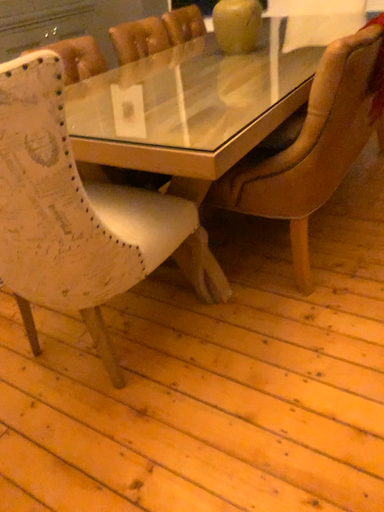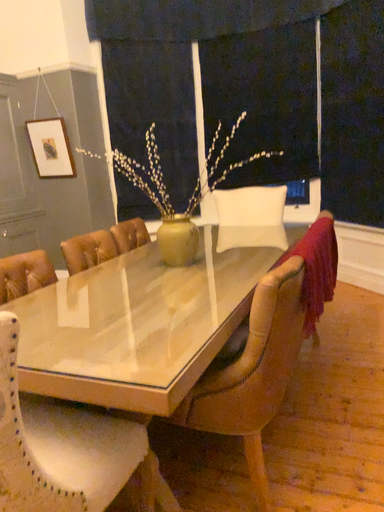
Question: How did the camera likely rotate when shooting the video?

Choices:
 (A) rotated left
 (B) rotated right

Answer: (B)